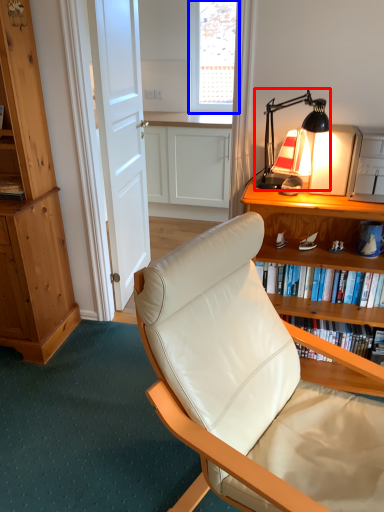
Question: Which of the following is the farthest to the observer, lamp (highlighted by a red box) or window screen (highlighted by a blue box)?

Choices:
 (A) lamp
 (B) window screen

Answer: (B)